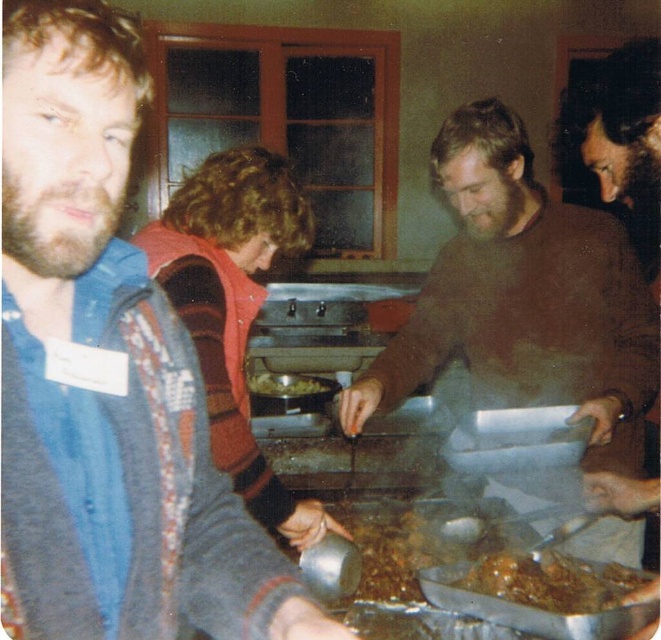
You are standing at the entrance of the room and want to locate the brown matte sweater at center. According to the coordinates provided, where should you look relative to the center of the image?

The brown matte sweater at center is located at coordinates point (x=524, y=298), which means it is slightly to the right and above the center of the image.